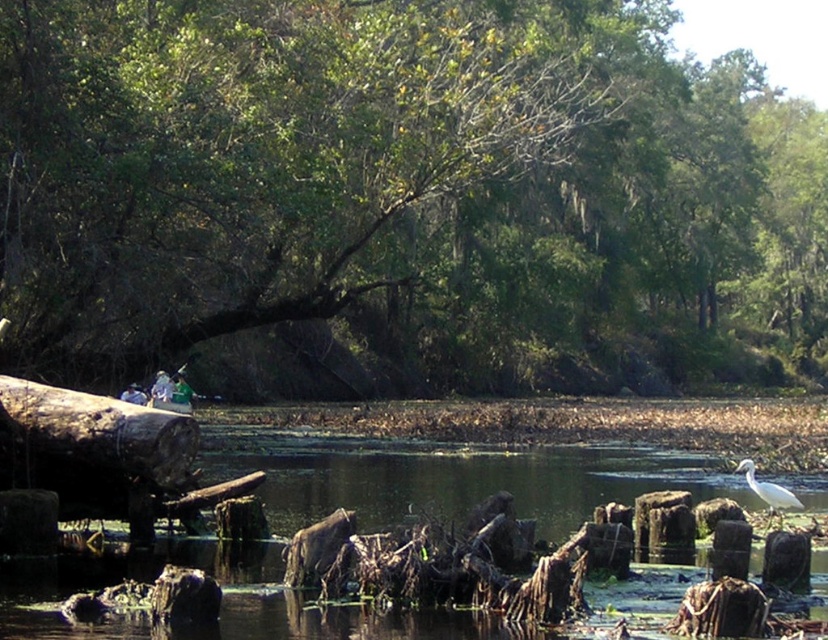
Question: Among these points, which one is farthest from the camera?

Choices:
 (A) (590, 44)
 (B) (751, 465)
 (C) (133, 452)

Answer: (A)

Question: Is green leafy tree at upper center below rough wooden log at left?

Choices:
 (A) no
 (B) yes

Answer: (A)

Question: Does green leafy tree at upper center lie behind white matte bird at lower right?

Choices:
 (A) yes
 (B) no

Answer: (A)

Question: Which point is closer to the camera taking this photo?

Choices:
 (A) (87, 464)
 (B) (627, 202)

Answer: (A)

Question: Which point is closer to the camera taking this photo?

Choices:
 (A) (756, 490)
 (B) (171, 460)
 (C) (431, 252)

Answer: (B)

Question: Can you confirm if rough wooden log at left is positioned above white matte bird at lower right?

Choices:
 (A) no
 (B) yes

Answer: (B)